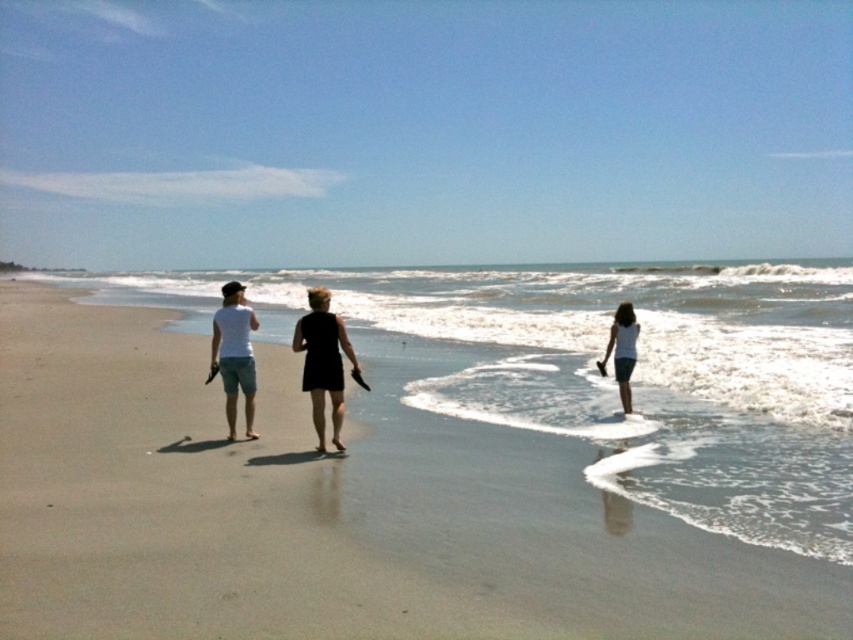
Question: Does sandy beach at center have a larger size compared to matte white t-shirt at left?

Choices:
 (A) no
 (B) yes

Answer: (B)

Question: Which of these objects is positioned farthest from the sandy beach at center?

Choices:
 (A) white matte dress at center
 (B) black matte dress at center
 (C) matte white t-shirt at left
 (D) white cotton shirt at center

Answer: (C)

Question: Does matte white t-shirt at left have a larger size compared to white matte dress at center?

Choices:
 (A) no
 (B) yes

Answer: (A)

Question: Which object is farther from the camera taking this photo?

Choices:
 (A) white matte dress at center
 (B) matte white t-shirt at left
 (C) sandy beach at center
 (D) white cotton shirt at center

Answer: (A)

Question: Which object appears farthest from the camera in this image?

Choices:
 (A) white cotton shirt at center
 (B) black matte dress at center
 (C) white matte dress at center
 (D) matte white t-shirt at left

Answer: (C)

Question: Where is sandy beach at center located in relation to black matte dress at center in the image?

Choices:
 (A) above
 (B) below

Answer: (A)